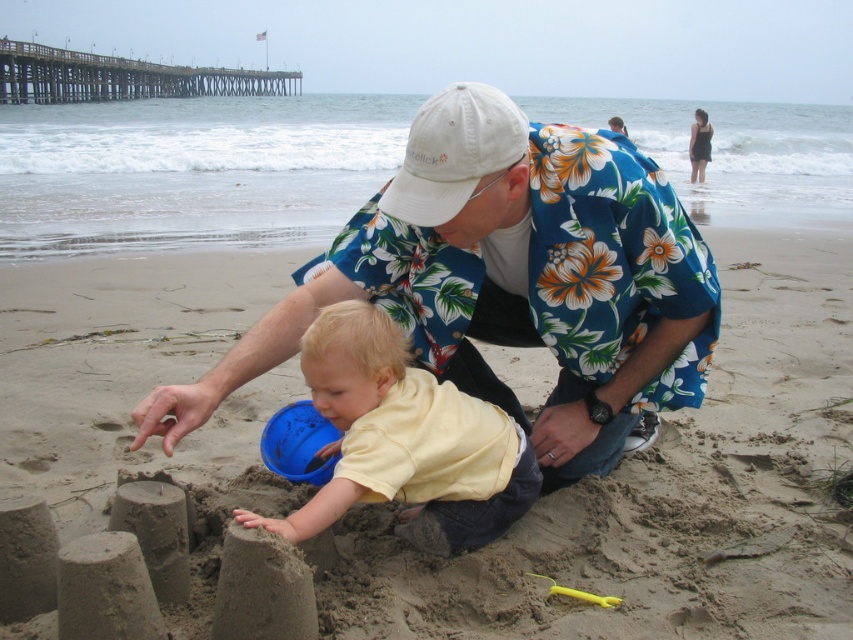
You are a photographer trying to capture a photo of the beach scene. You want to ensure both the floral shirt at center and the yellow matte shirt at center are clearly visible in the frame. Based on their positions, which shirt should you focus on first to ensure both are in focus?

The floral shirt at center is in front of the yellow matte shirt at center. To ensure both are in focus, you should focus on the floral shirt at center first since it is closer to the camera, and the yellow matte shirt at center will be in the background.

You are a photographer trying to capture a closeup of the yellow plastic shovel at lower center without the yellow matte shirt at center blocking the view. Based on their sizes, which object should you focus on first to ensure the shovel is in frame?

The yellow matte shirt at center is larger than the yellow plastic shovel at lower center, so you should focus on the yellow plastic shovel at lower center first to ensure it is in frame without obstruction.

You are a photographer trying to capture a closeup of both the floral shirt at center and the yellow matte shirt at center. Since you want both shirts to be clearly visible in the photo, which shirt should you focus on to ensure both are in focus?

You should focus on the floral shirt at center because it is wider than the yellow matte shirt at center, so focusing on the wider shirt will help both shirts be in focus.